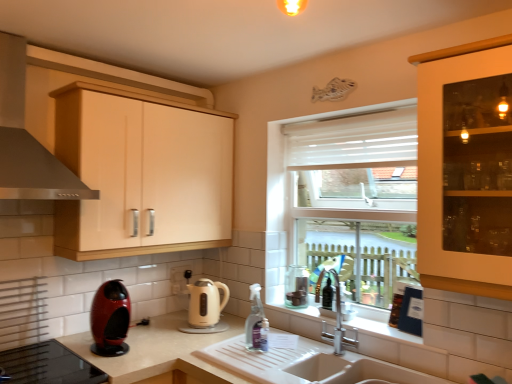
Question: Is point (132, 233) closer or farther from the camera than point (266, 345)?

Choices:
 (A) farther
 (B) closer

Answer: (A)

Question: Relative to clear plastic spray bottle at sink, is matte wood cabinet at upper left in front or behind?

Choices:
 (A) behind
 (B) front

Answer: (B)

Question: Based on their relative distances, which object is nearer to the clear plastic spray bottle at sink?

Choices:
 (A) satin silver exhaust hood at upper left
 (B) metallic red coffee machine at lower left
 (C) white matte countertop at lower left
 (D) matte wood cabinet at upper left
 (E) beige glossy electric kettle at center

Answer: (E)

Question: Which object is positioned farthest from the satin silver exhaust hood at upper left?

Choices:
 (A) clear plastic spray bottle at sink
 (B) white matte countertop at lower left
 (C) metallic red coffee machine at lower left
 (D) beige glossy electric kettle at center
 (E) matte wood cabinet at upper left

Answer: (A)